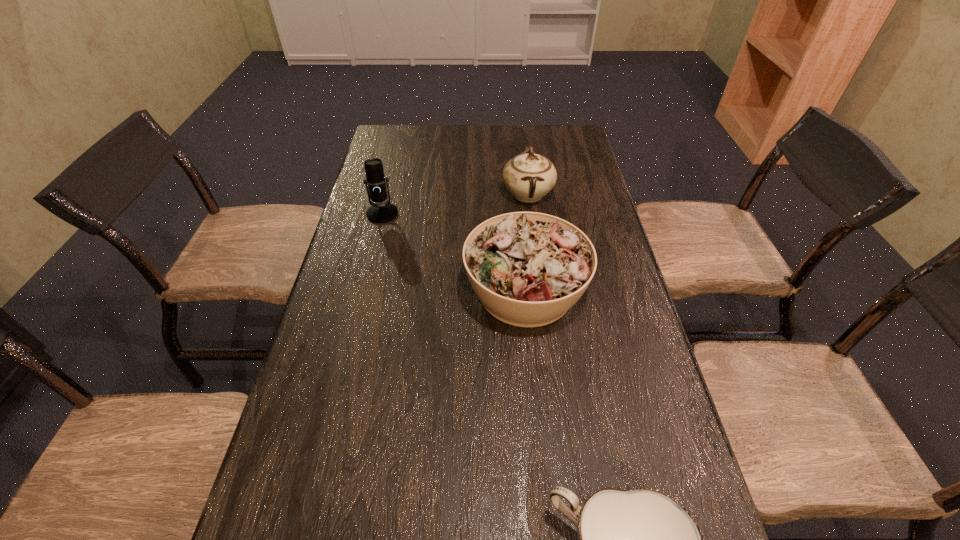
At what (x,y) coordinates should I click in order to perform the action: click on microphone. Please return your answer as a coordinate pair (x, y). The width and height of the screenshot is (960, 540). Looking at the image, I should click on (383, 212).

Where is `the farther chinaware`? The height and width of the screenshot is (540, 960). the farther chinaware is located at coordinates (528, 176).

This screenshot has height=540, width=960. Identify the location of salad. (528, 269).

The image size is (960, 540). Identify the location of vacant space located on the back of the microphone. (396, 161).

At what (x,y) coordinates should I click in order to perform the action: click on vacant space located on the right of the farther chinaware. Please return your answer as a coordinate pair (x, y). This screenshot has height=540, width=960. Looking at the image, I should click on (582, 194).

The width and height of the screenshot is (960, 540). Identify the location of free region located 0.220m on the front of the salad. click(539, 432).

Find the location of `object situated at the left edge`. object situated at the left edge is located at coordinates (383, 212).

Locate an element on the screen. This screenshot has height=540, width=960. chinaware that is positioned at the right edge is located at coordinates (528, 176).

Find the location of `salad located in the right edge section of the desktop`. salad located in the right edge section of the desktop is located at coordinates (528, 269).

In the image, there is a desktop. Where is `vacant space at the far edge`? The height and width of the screenshot is (540, 960). vacant space at the far edge is located at coordinates tap(540, 148).